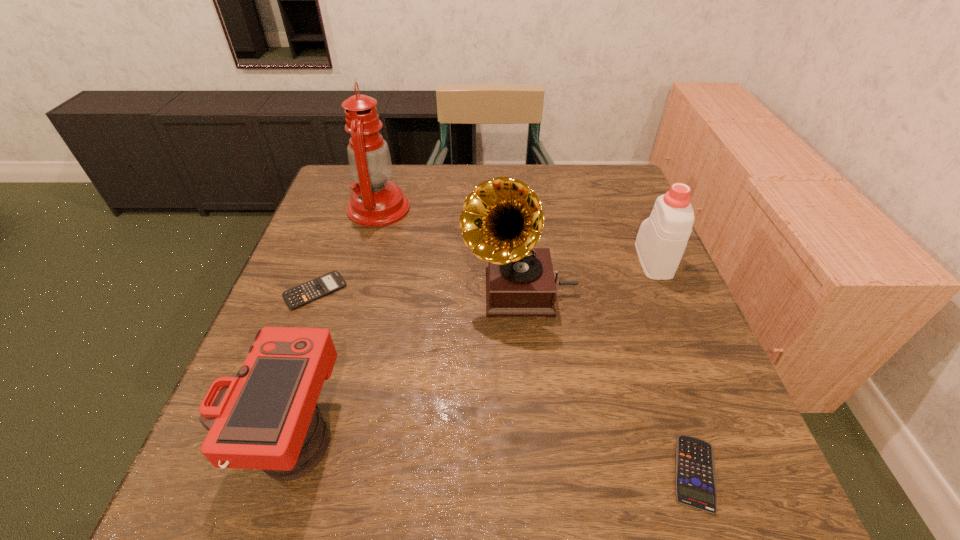
The image size is (960, 540). What are the coordinates of `camera at the near edge` in the screenshot? It's located at (263, 417).

I want to click on calculator situated at the near edge, so click(695, 473).

Locate an element on the screen. Image resolution: width=960 pixels, height=540 pixels. oil lamp located at the left edge is located at coordinates (376, 202).

The height and width of the screenshot is (540, 960). Find the location of `camera that is at the left edge`. camera that is at the left edge is located at coordinates [263, 417].

The height and width of the screenshot is (540, 960). Find the location of `calculator at the left edge`. calculator at the left edge is located at coordinates [300, 295].

Find the location of a particular element. The image size is (960, 540). detergent present at the right edge is located at coordinates tap(662, 238).

Find the location of a particular element. The width and height of the screenshot is (960, 540). calculator that is at the right edge is located at coordinates (695, 473).

Find the location of a particular element. object positioned at the far left corner is located at coordinates (376, 202).

You are a GUI agent. You are given a task and a screenshot of the screen. Output one action in this format:
    pyautogui.click(x=<x>, y=<y>)
    Task: Click on the object at the near left corner
    
    Given the screenshot: What is the action you would take?
    pyautogui.click(x=263, y=417)

At what (x,y) coordinates should I click in order to perform the action: click on object located at the near right corner. Please return your answer as a coordinate pair (x, y). Looking at the image, I should click on (695, 473).